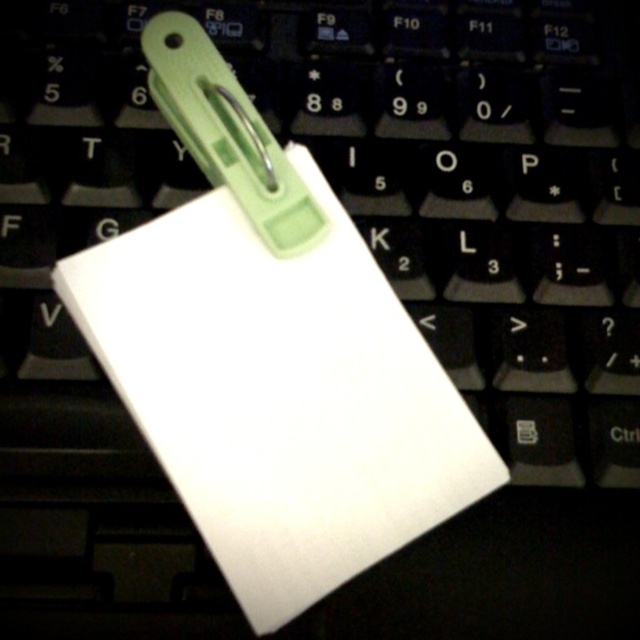
You are looking at the white rectangular paper clipped to the keyboard. There are two points marked on the paper, one at coordinates point (x=80, y=301) and the other at point (x=268, y=147). Which point is closer to you?

Point (x=80, y=301) is closer to the viewer than point (x=268, y=147).

You are trying to locate the green plastic clip at center on your keyboard. You see the white matte notepad at center. Which direction should you move from the notepad to find the clip?

The green plastic clip at center is to the left of the white matte notepad at center, so you should move left from the notepad to find the clip.

You need to access the green plastic clip at center to adjust it. Based on the scene, can you reach it without moving the white matte notepad at center?

The white matte notepad at center is in front of the green plastic clip at center, so you cannot reach the green plastic clip at center without moving the white matte notepad at center first.